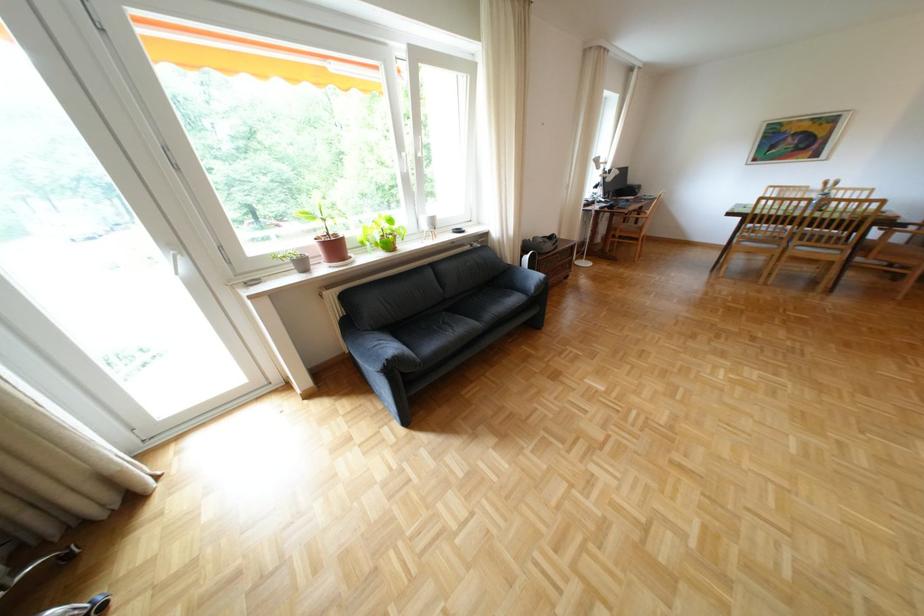
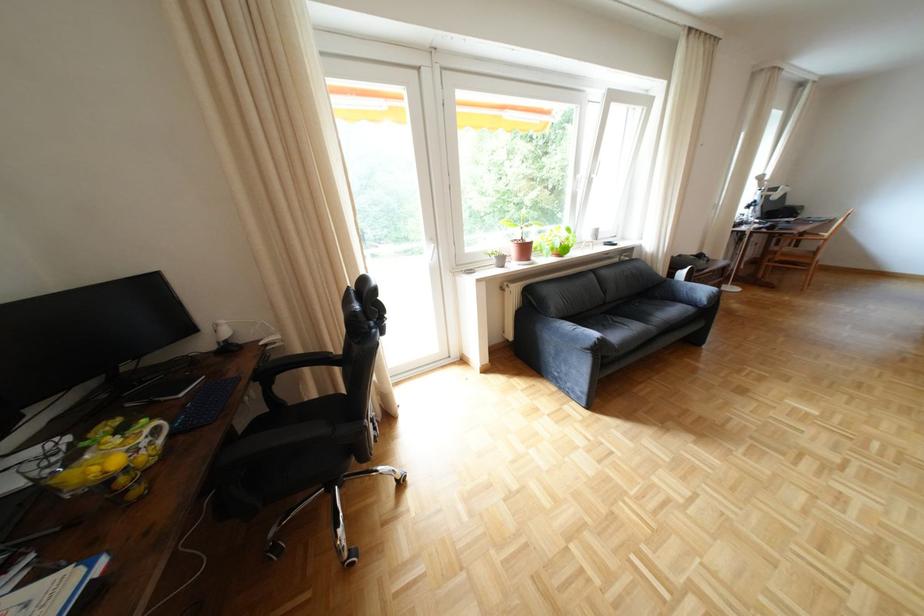
What movement of the cameraman would produce the second image?

The movement direction of the cameraman is left, backward.